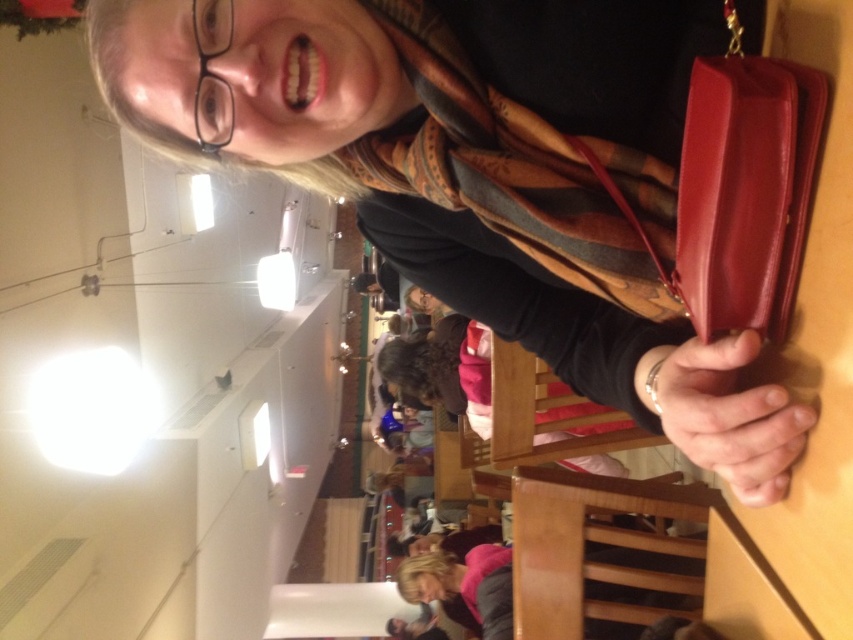
In the scene shown: You are a photographer trying to capture a closeup of the plaid wool scarf at upper right and the leather handbag at right. Since you want both items to be clearly visible in the frame, which object should you focus on to ensure the larger one is in focus first?

The plaid wool scarf at upper right is wider than the leather handbag at right, so you should focus on the plaid wool scarf at upper right first to ensure it is in focus since it is larger.

You are standing in the image and want to reach the plaid wool scarf at upper right. Which direction should you move to get closer to it?

The plaid wool scarf at upper right is located at point (500, 168), so you should move towards the upper right direction to get closer to it.

You are a photographer trying to capture the leather handbag at right and the plaid wool scarf at upper right in a single shot. Since the camera can only focus on one object at a time, which object should you focus on to ensure the other is still in the frame?

You should focus on the plaid wool scarf at upper right because the leather handbag at right is behind it, so keeping the scarf in focus will keep the handbag within the frame as well.